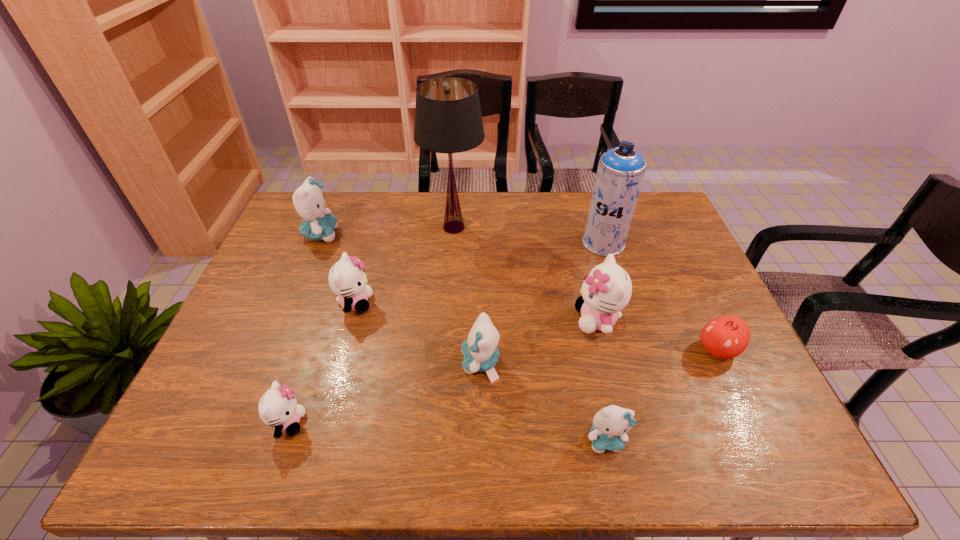
Find the location of `blue kitten that is the second closest to the red apple`. blue kitten that is the second closest to the red apple is located at coordinates (480, 351).

The width and height of the screenshot is (960, 540). Find the location of `white kitten identified as the closest to the fourth kitten from left to right`. white kitten identified as the closest to the fourth kitten from left to right is located at coordinates (607, 289).

At what (x,y) coordinates should I click in order to perform the action: click on the second closest white kitten to the second biggest white kitten. Please return your answer as a coordinate pair (x, y). This screenshot has height=540, width=960. Looking at the image, I should click on (607, 289).

The width and height of the screenshot is (960, 540). I want to click on vacant region that satisfies the following two spatial constraints: 1. on the back side of the red apple; 2. on the front-facing side of the second biggest white kitten, so click(695, 303).

Locate an element on the screen. This screenshot has width=960, height=540. vacant area in the image that satisfies the following two spatial constraints: 1. on the face of the biggest blue kitten; 2. on the back side of the second tallest object is located at coordinates (317, 243).

This screenshot has width=960, height=540. I want to click on free space that satisfies the following two spatial constraints: 1. on the front-facing side of the red apple; 2. on the left side of the lampshade, so click(x=445, y=350).

The height and width of the screenshot is (540, 960). Find the location of `vacant space that satisfies the following two spatial constraints: 1. on the face of the apple; 2. on the left side of the leftmost object`. vacant space that satisfies the following two spatial constraints: 1. on the face of the apple; 2. on the left side of the leftmost object is located at coordinates (273, 350).